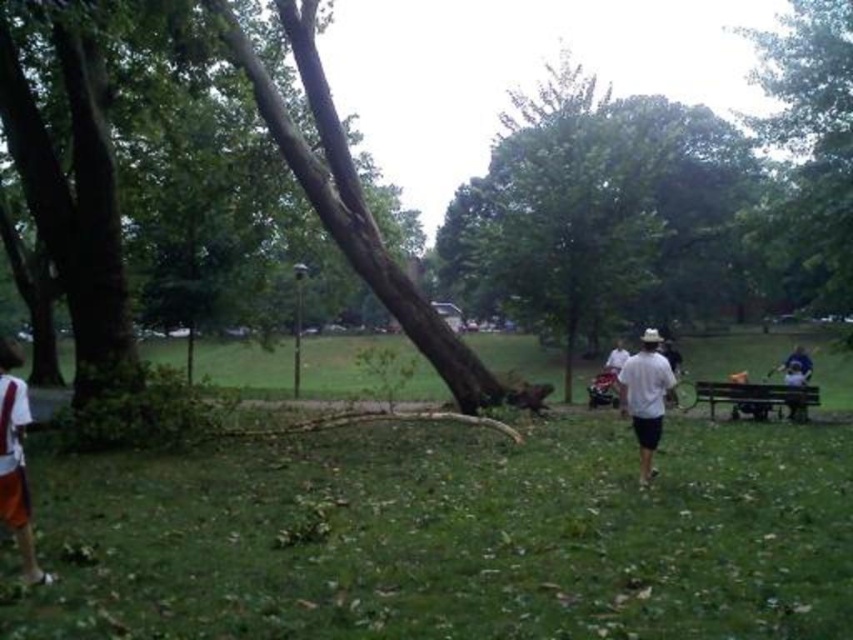
You are standing in the park and see the brown rough bark tree at center and the green grassy field at center. Which object is located to the right of the other?

The brown rough bark tree at center is positioned on the right side of green grassy field at center.

You are standing at the wooden picnic table at lower right and want to reach the brown rough bark tree at center. Which direction should you move in?

You should move to the left to reach the brown rough bark tree at center because it is located to the right of the wooden picnic table at lower right, so moving left from the table will face you towards the tree.